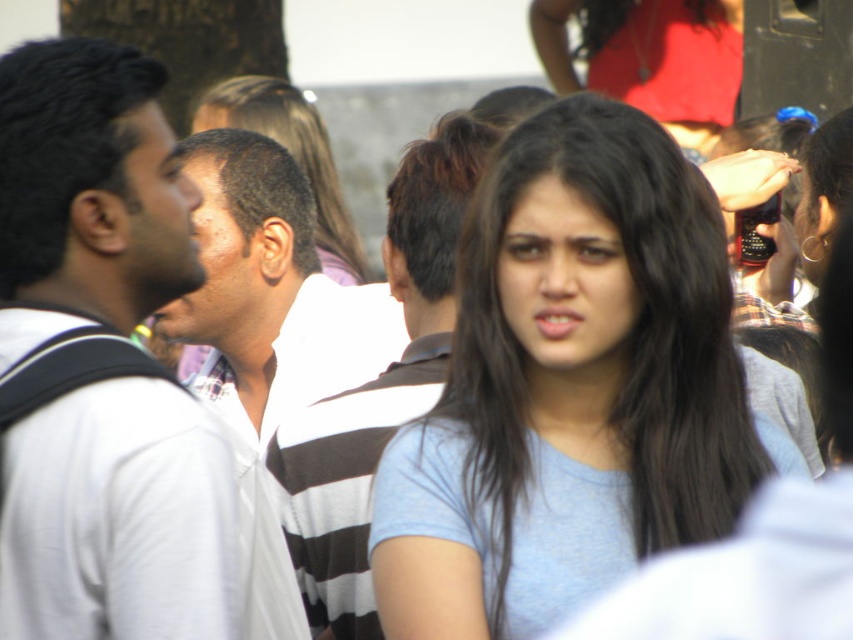
Is the position of white matte shirt at left less distant than that of striped shirt at center?

Yes, it is in front of striped shirt at center.

Between white matte shirt at left and striped shirt at center, which one is positioned lower?

striped shirt at center

Is point (164, 211) more distant than point (418, 212)?

No, (164, 211) is closer to viewer.

Locate an element on the screen. The height and width of the screenshot is (640, 853). white matte shirt at left is located at coordinates (112, 376).

Who is positioned more to the left, light blue cotton shirt at center or white matte shirt at left?

white matte shirt at left is more to the left.

Does light blue cotton shirt at center have a greater width compared to white matte shirt at left?

Indeed, light blue cotton shirt at center has a greater width compared to white matte shirt at left.

Is point (544, 609) farther from camera compared to point (143, 609)?

Yes, it is behind point (143, 609).

Identify the location of light blue cotton shirt at center. (569, 387).

Does light blue cotton shirt at center appear on the left side of striped shirt at center?

Incorrect, light blue cotton shirt at center is not on the left side of striped shirt at center.

Does point (514, 310) come in front of point (404, 310)?

Yes, it is in front of point (404, 310).

Describe the element at coordinates (569, 387) in the screenshot. I see `light blue cotton shirt at center` at that location.

Where is `light blue cotton shirt at center`? Image resolution: width=853 pixels, height=640 pixels. light blue cotton shirt at center is located at coordinates (569, 387).